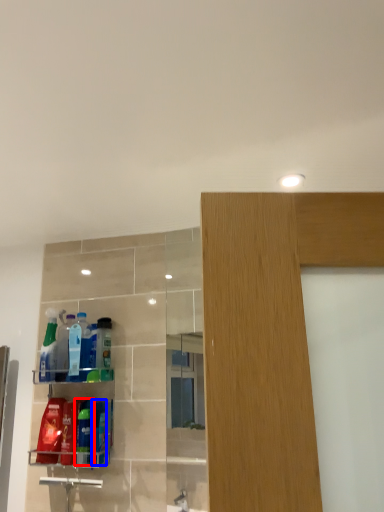
Question: Which point is closer to the camera, cleaning product (highlighted by a red box) or cleaning product (highlighted by a blue box)?

Choices:
 (A) cleaning product
 (B) cleaning product

Answer: (B)